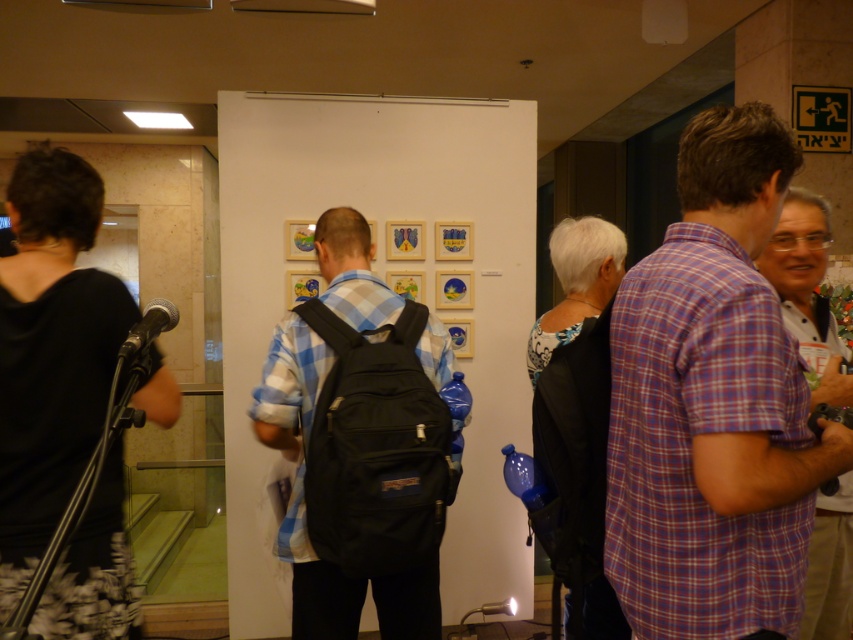
You are a photographer standing in the center of the room. You want to take a photo of the purple plaid shirt at right and the plaid cotton shirt at right without any people blocking the view. Since you can only move forward or backward, can you fit both shirts in the frame if your camera has a 50mm lens?

The purple plaid shirt at right is 13.82 inches away from the plaid cotton shirt at right. With a 50mm lens, the distance between the two shirts is within the camera lens range, so you can fit both shirts in the frame by adjusting your position appropriately.

You are an event organizer trying to arrange seating for a discussion panel. You notice two people in the scene wearing shirts labeled as purple plaid shirt at right and plaid cotton shirt at right. Which of these two shirts is narrower in width?

The purple plaid shirt at right is thinner than plaid cotton shirt at right, so the purple plaid shirt at right is narrower in width.